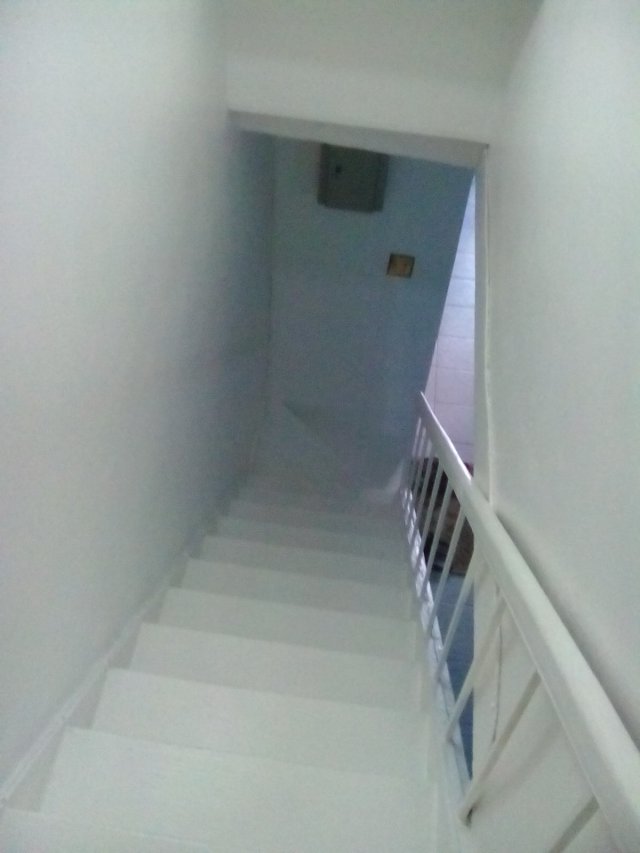
Where is `handrail`? This screenshot has width=640, height=853. handrail is located at coordinates (482, 521).